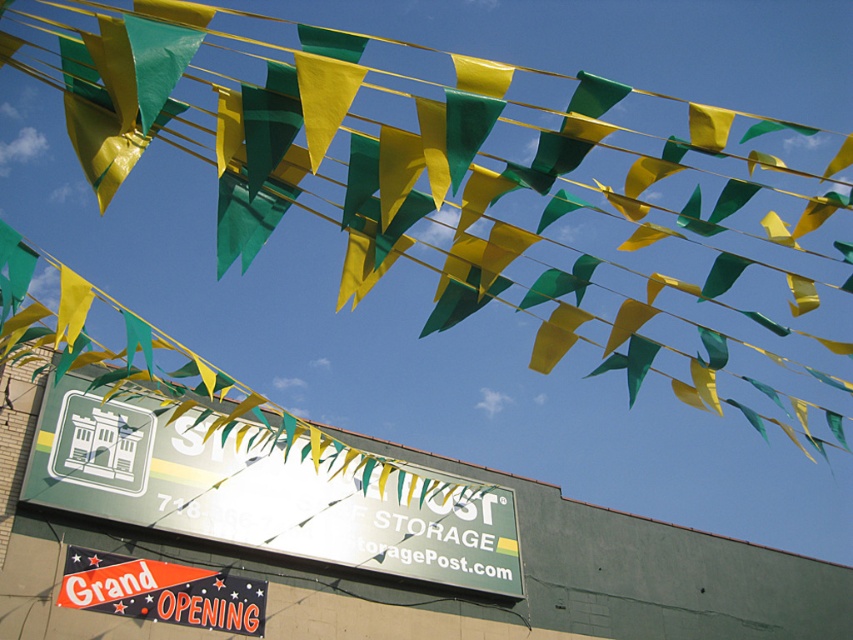
Does green fabric flag at upper center appear under green matte signboard at center?

No.

Can you confirm if green fabric flag at upper center is bigger than green matte signboard at center?

Correct, green fabric flag at upper center is larger in size than green matte signboard at center.

Which is in front, point (656, 362) or point (187, 525)?

Positioned in front is point (656, 362).

Locate an element on the screen. Image resolution: width=853 pixels, height=640 pixels. green fabric flag at upper center is located at coordinates (485, 192).